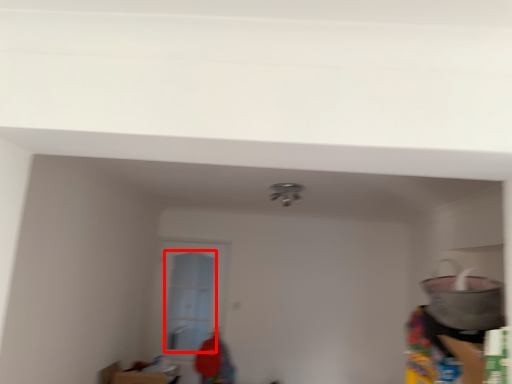
Question: In this image, where is glass door (annotated by the red box) located relative to appliance?

Choices:
 (A) left
 (B) right

Answer: (A)